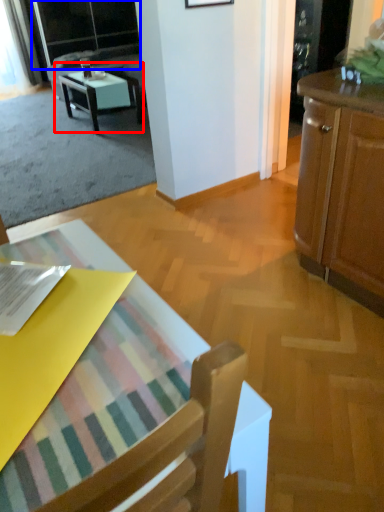
Question: Which object is further to the camera taking this photo, table (highlighted by a red box) or screen door (highlighted by a blue box)?

Choices:
 (A) table
 (B) screen door

Answer: (B)